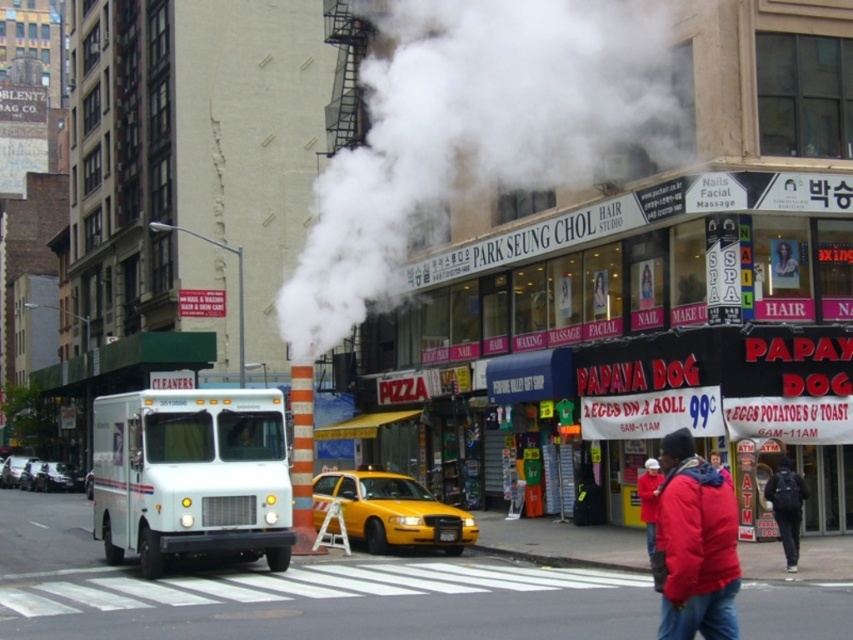
Does point (467, 52) come farther from viewer compared to point (688, 531)?

Yes, it is.

From the picture: Is white steam at center thinner than red matte jacket at lower right?

No.

Does point (549, 3) come closer to viewer compared to point (679, 428)?

No, it is behind (679, 428).

You are a GUI agent. You are given a task and a screenshot of the screen. Output one action in this format:
    pyautogui.click(x=<x>, y=<y>)
    Task: Click on the white steam at center
    
    Given the screenshot: What is the action you would take?
    pyautogui.click(x=474, y=132)

Who is lower down, red matte jacket at lower right or yellow matte taxi at center?

Positioned lower is yellow matte taxi at center.

Which of these two, red matte jacket at lower right or yellow matte taxi at center, stands taller?

With more height is red matte jacket at lower right.

Is point (683, 627) behind point (363, 486)?

No, (683, 627) is in front of (363, 486).

You are a GUI agent. You are given a task and a screenshot of the screen. Output one action in this format:
    pyautogui.click(x=<x>, y=<y>)
    Task: Click on the red matte jacket at lower right
    The width and height of the screenshot is (853, 640).
    Given the screenshot: What is the action you would take?
    pyautogui.click(x=695, y=545)

Between red matte jacket at lower right and dark blue jacket at lower right, which one has more height?

dark blue jacket at lower right is taller.

Identify the location of red matte jacket at lower right. (695, 545).